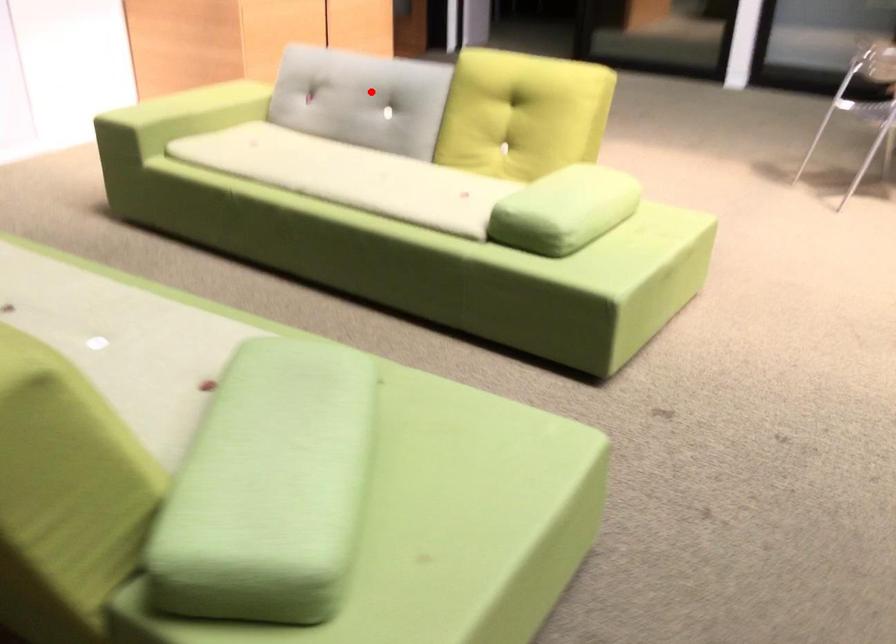
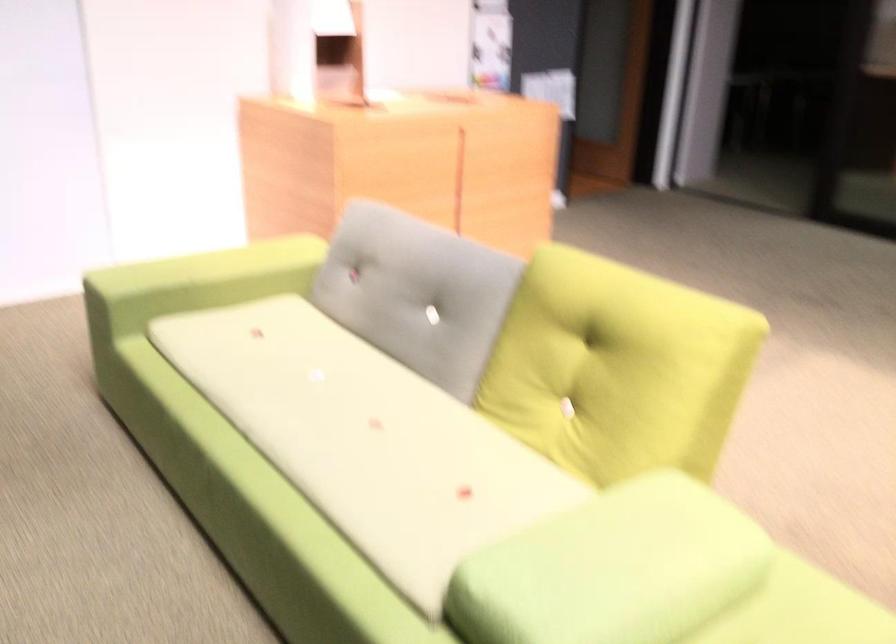
Question: I am providing you with two images of the same scene from different viewpoints. Given a red point in image1, look at the same physical point in image2. Is it:

Choices:
 (A) Closer to the viewpoint
 (B) Farther from the viewpoint

Answer: (A)